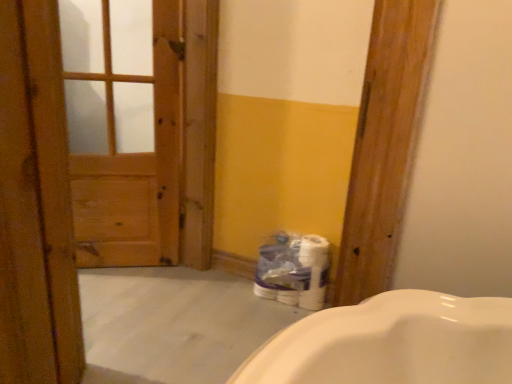
What is the approximate width of wooden door at left?

The width of wooden door at left is 1.15 inches.

This screenshot has height=384, width=512. What do you see at coordinates (293, 270) in the screenshot?
I see `white glossy toilet paper at lower center` at bounding box center [293, 270].

Where is `wooden door at left`? The image size is (512, 384). wooden door at left is located at coordinates (123, 128).

Locate an element on the screen. This screenshot has width=512, height=384. wooden door at left is located at coordinates (35, 204).

Between wooden door at left and white glossy toilet paper at lower center, which one has less height?

white glossy toilet paper at lower center.

Is white glossy toilet paper at lower center at the back of wooden door at left?

wooden door at left is not turned away from white glossy toilet paper at lower center.

Is point (40, 251) farther from camera compared to point (322, 239)?

No, (40, 251) is in front of (322, 239).

Is the depth of wooden door at left less than that of white glossy toilet paper at lower center?

Yes, it is in front of white glossy toilet paper at lower center.

Which of these two, wooden door at left or wooden door at left, is bigger?

wooden door at left.

Based on the photo, is wooden door at left thinner than wooden door at left?

Yes, wooden door at left is thinner than wooden door at left.

Considering the sizes of objects wooden door at left and wooden door at left in the image provided, who is taller, wooden door at left or wooden door at left?

Standing taller between the two is wooden door at left.

Which object is positioned more to the right, wooden door at left or wooden door at left?

wooden door at left.

From the image's perspective, is white glossy toilet paper at lower center over wooden door at left?

Actually, white glossy toilet paper at lower center appears below wooden door at left in the image.

Between white glossy toilet paper at lower center and wooden door at left, which one has more height?

wooden door at left.

Choose the correct answer: Is white glossy toilet paper at lower center inside wooden door at left or outside it?

white glossy toilet paper at lower center is not inside wooden door at left, it's outside.

How many degrees apart are the facing directions of white glossy toilet paper at lower center and wooden door at left?

white glossy toilet paper at lower center and wooden door at left are facing 89.2 degrees away from each other.

This screenshot has height=384, width=512. Find the location of `toilet paper below the wooden door at left (from the image's perspective)`. toilet paper below the wooden door at left (from the image's perspective) is located at coordinates (293, 270).

Considering the sizes of wooden door at left and white glossy toilet paper at lower center in the image, is wooden door at left taller or shorter than white glossy toilet paper at lower center?

wooden door at left is taller than white glossy toilet paper at lower center.

Is wooden door at left turned away from white glossy toilet paper at lower center?

No, white glossy toilet paper at lower center is not at the back of wooden door at left.

Consider the image. Is there a large distance between wooden door at left and white glossy toilet paper at lower center?

They are positioned close to each other.

Does white glossy toilet paper at lower center have a greater width compared to wooden door at left?

Yes, white glossy toilet paper at lower center is wider than wooden door at left.

Are white glossy toilet paper at lower center and wooden door at left far apart?

white glossy toilet paper at lower center is near wooden door at left, not far away.

How much distance is there between white glossy toilet paper at lower center and wooden door at left?

The distance of white glossy toilet paper at lower center from wooden door at left is 29.03 inches.

Is white glossy toilet paper at lower center positioned with its back to wooden door at left?

No.

Is wooden door at left facing towards wooden door at left?

No, wooden door at left does not turn towards wooden door at left.

Does wooden door at left have a greater width compared to wooden door at left?

Incorrect, the width of wooden door at left does not surpass that of wooden door at left.

How many degrees apart are the facing directions of wooden door at left and wooden door at left?

The angle between the facing direction of wooden door at left and the facing direction of wooden door at left is 5.57 degrees.

This screenshot has width=512, height=384. In the image, there is a wooden door at left. Identify the location of door below it (from a real-world perspective). (35, 204).

Does wooden door at left come in front of wooden door at left?

Yes, wooden door at left is closer to the camera.

Who is smaller, wooden door at left or wooden door at left?

Smaller between the two is wooden door at left.

Does point (183, 208) come in front of point (137, 111)?

Yes, it is in front of point (137, 111).

Consider the image. Is wooden door at left not inside wooden door at left?

Indeed, wooden door at left is completely outside wooden door at left.

Identify the location of door that appears above the white glossy toilet paper at lower center (from the image's perspective). (35, 204).

Find the location of a particular element. This screenshot has width=512, height=384. screen door that appears behind the wooden door at left is located at coordinates (123, 128).

Estimate the real-world distances between objects in this image. Which object is further from wooden door at left, wooden door at left or wooden door at left?

wooden door at left.

Estimate the real-world distances between objects in this image. Which object is closer to wooden door at left, wooden door at left or white glossy toilet paper at lower center?

The object closer to wooden door at left is wooden door at left.

Looking at the image, which one is located closer to white glossy toilet paper at lower center, wooden door at left or wooden door at left?

wooden door at left is closer to white glossy toilet paper at lower center.

Based on their spatial positions, is wooden door at left or wooden door at left further from white glossy toilet paper at lower center?

Based on the image, wooden door at left appears to be further to white glossy toilet paper at lower center.

Considering their positions, is white glossy toilet paper at lower center positioned further to wooden door at left than wooden door at left?

white glossy toilet paper at lower center is further to wooden door at left.

When comparing their distances from wooden door at left, does wooden door at left or wooden door at left seem closer?

Among the two, wooden door at left is located nearer to wooden door at left.

From the image, which object appears to be nearer to wooden door at left, wooden door at left or wooden door at left?

wooden door at left.

Which object lies further to the anchor point wooden door at left, wooden door at left or wooden door at left?

The object further to wooden door at left is wooden door at left.

At what (x,y) coordinates should I click in order to perform the action: click on barn door between wooden door at left and white glossy toilet paper at lower center from left to right. Please return your answer as a coordinate pair (x, y). Looking at the image, I should click on (97, 160).

Where is `screen door between wooden door at left and white glossy toilet paper at lower center from front to back`? screen door between wooden door at left and white glossy toilet paper at lower center from front to back is located at coordinates (123, 128).

What are the coordinates of `barn door between wooden door at left and white glossy toilet paper at lower center from front to back` in the screenshot? It's located at (97, 160).

I want to click on barn door between wooden door at left and wooden door at left along the z-axis, so click(x=97, y=160).